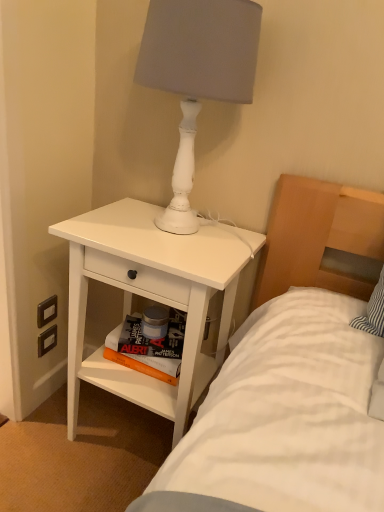
Find the location of a particular element. Image resolution: width=384 pixels, height=512 pixels. vacant area situated below white matte lamp at upper right (from a real-world perspective) is located at coordinates (172, 233).